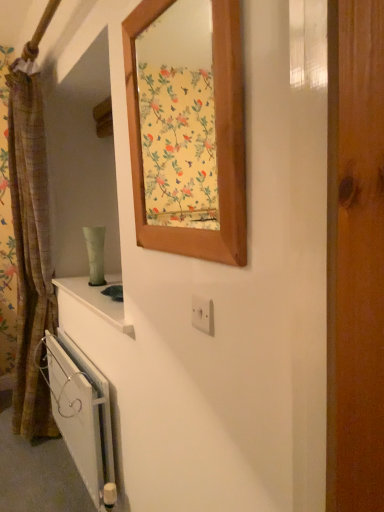
Question: From the image's perspective, is white plastic electric outlet at center above or below wooden frame at upper center?

Choices:
 (A) above
 (B) below

Answer: (B)

Question: From a real-world perspective, is white plastic electric outlet at center positioned above or below wooden frame at upper center?

Choices:
 (A) above
 (B) below

Answer: (B)

Question: Which object is the farthest from the white metallic radiator at lower left?

Choices:
 (A) white plastic electric outlet at center
 (B) brown textured curtain at left
 (C) wooden frame at upper center

Answer: (C)

Question: Based on their relative distances, which object is nearer to the white plastic electric outlet at center?

Choices:
 (A) brown textured curtain at left
 (B) white metallic radiator at lower left
 (C) wooden frame at upper center

Answer: (B)